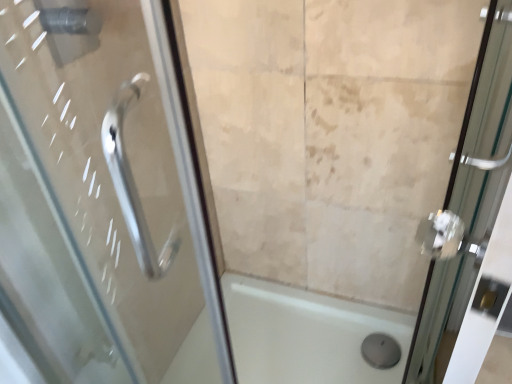
Describe the element at coordinates (306, 334) in the screenshot. The width and height of the screenshot is (512, 384). I see `white glossy bath at center` at that location.

Find the location of a particular element. white glossy bath at center is located at coordinates (306, 334).

This screenshot has height=384, width=512. What do you see at coordinates (470, 187) in the screenshot? I see `clear glass door at right` at bounding box center [470, 187].

Locate an element on the screen. This screenshot has width=512, height=384. clear glass door at right is located at coordinates (470, 187).

The image size is (512, 384). In order to click on white glossy bath at center in this screenshot , I will do `click(306, 334)`.

Does white glossy bath at center appear on the right side of clear glass door at right?

In fact, white glossy bath at center is to the left of clear glass door at right.

Which object is closer to the camera taking this photo, white glossy bath at center or clear glass door at right?

clear glass door at right is in front.

Which is nearer, (201, 373) or (482, 103)?

Point (201, 373) is closer to the camera than point (482, 103).

From the image's perspective, which one is positioned lower, white glossy bath at center or clear glass door at right?

white glossy bath at center.

From a real-world perspective, is white glossy bath at center physically above clear glass door at right?

No.

Which of these two, white glossy bath at center or clear glass door at right, is thinner?

clear glass door at right is thinner.

Between white glossy bath at center and clear glass door at right, which one has less height?

white glossy bath at center.

In terms of size, does white glossy bath at center appear bigger or smaller than clear glass door at right?

white glossy bath at center is smaller than clear glass door at right.

Would you say white glossy bath at center is inside or outside clear glass door at right?

white glossy bath at center exists outside the volume of clear glass door at right.

Can you see white glossy bath at center touching clear glass door at right?

white glossy bath at center and clear glass door at right are clearly separated.

Is white glossy bath at center facing away from clear glass door at right?

That's not correct — white glossy bath at center is not looking away from clear glass door at right.

How different are the orientations of white glossy bath at center and clear glass door at right in degrees?

106 degrees separate the facing orientations of white glossy bath at center and clear glass door at right.

You are a GUI agent. You are given a task and a screenshot of the screen. Output one action in this format:
    pyautogui.click(x=<x>, y=<y>)
    Task: Click on the bath behind the clear glass door at right
    The width and height of the screenshot is (512, 384).
    Given the screenshot: What is the action you would take?
    pyautogui.click(x=306, y=334)

Consider the image. Based on their positions, is clear glass door at right located to the left or right of white glossy bath at center?

From the image, it's evident that clear glass door at right is to the right of white glossy bath at center.

Between clear glass door at right and white glossy bath at center, which one is positioned in front?

clear glass door at right is closer to the camera.

Considering the points (440, 298) and (334, 310), which point is behind, point (440, 298) or point (334, 310)?

The point (334, 310) is behind.

From the image's perspective, relative to white glossy bath at center, is clear glass door at right above or below?

clear glass door at right is situated higher than white glossy bath at center in the image.

From a real-world perspective, who is located higher, clear glass door at right or white glossy bath at center?

clear glass door at right, from a real-world perspective.

Considering the sizes of clear glass door at right and white glossy bath at center in the image, is clear glass door at right wider or thinner than white glossy bath at center?

In the image, clear glass door at right appears to be more narrow than white glossy bath at center.

Based on the photo, between clear glass door at right and white glossy bath at center, which one has less height?

white glossy bath at center is shorter.

In the scene shown: Considering the relative sizes of clear glass door at right and white glossy bath at center in the image provided, is clear glass door at right smaller than white glossy bath at center?

Actually, clear glass door at right might be larger than white glossy bath at center.

Would you say clear glass door at right is outside white glossy bath at center?

Yes.

Is clear glass door at right positioned far away from white glossy bath at center?

They are positioned close to each other.

Is clear glass door at right looking in the opposite direction of white glossy bath at center?

Correct, clear glass door at right is looking away from white glossy bath at center.

How different are the orientations of clear glass door at right and white glossy bath at center in degrees?

clear glass door at right and white glossy bath at center are facing 106 degrees away from each other.

Locate an element on the screen. The width and height of the screenshot is (512, 384). bath behind the clear glass door at right is located at coordinates (306, 334).

Locate an element on the screen. The height and width of the screenshot is (384, 512). bath that appears on the left of clear glass door at right is located at coordinates (306, 334).

The width and height of the screenshot is (512, 384). Find the location of `door located above the white glossy bath at center (from a real-world perspective)`. door located above the white glossy bath at center (from a real-world perspective) is located at coordinates (470, 187).